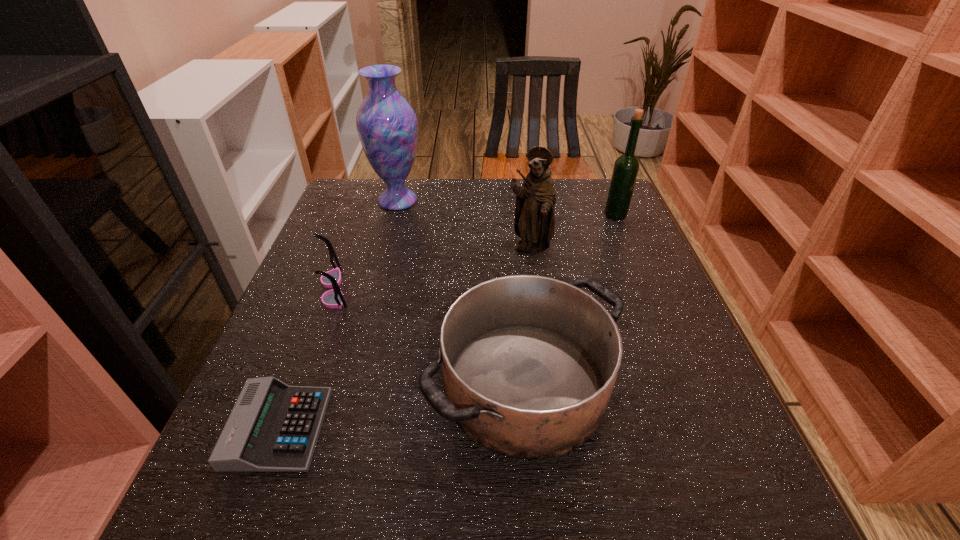
Identify the location of saucepan present at the right edge. The width and height of the screenshot is (960, 540). (529, 363).

Where is `object that is at the far left corner`? object that is at the far left corner is located at coordinates (386, 123).

The image size is (960, 540). What are the coordinates of `object that is at the near left corner` in the screenshot? It's located at (273, 427).

Locate an element on the screen. The width and height of the screenshot is (960, 540). object located in the far right corner section of the desktop is located at coordinates (626, 167).

Where is `vacant space at the far edge of the desktop`? Image resolution: width=960 pixels, height=540 pixels. vacant space at the far edge of the desktop is located at coordinates (472, 214).

The height and width of the screenshot is (540, 960). In the image, there is a desktop. Find the location of `vacant area at the near edge`. vacant area at the near edge is located at coordinates (504, 513).

The height and width of the screenshot is (540, 960). In the image, there is a desktop. What are the coordinates of `vacant space at the left edge` in the screenshot? It's located at (292, 367).

The image size is (960, 540). Find the location of `free space at the right edge of the desktop`. free space at the right edge of the desktop is located at coordinates (611, 227).

Find the location of `free region at the far left corner of the desktop`. free region at the far left corner of the desktop is located at coordinates (341, 218).

In the image, there is a desktop. Where is `vacant region at the near left corner`? The height and width of the screenshot is (540, 960). vacant region at the near left corner is located at coordinates (225, 498).